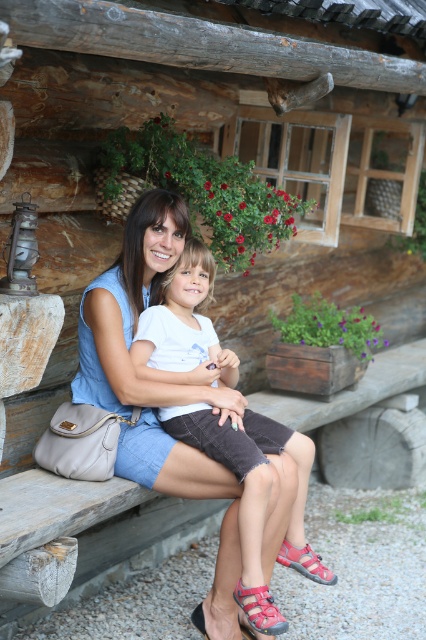
You are a photographer standing at the point marked as point (259, 609). You want to take a photo of the pink fabric sandal at lower center. Which direction should you face to capture it in your shot?

The pink fabric sandal at lower center is located at point (259, 609), so you should face directly towards that point to capture it in your shot.

You are a photographer trying to capture a closeup of the pink fabric sandal at lower center and the red synthetic sandal at lower center. Which sandal should you focus on first if you want to ensure both are in focus without moving the camera?

You should focus on the pink fabric sandal at lower center first because it is closer to the viewer than the red synthetic sandal at lower center, so adjusting focus from near to far will help both be in focus.

You are standing at the point closest to the log cabin. Which point, point (146, 240) or point (282, 544), is closer to you?

Point (146, 240) is in front of point (282, 544), so it is closer to you.